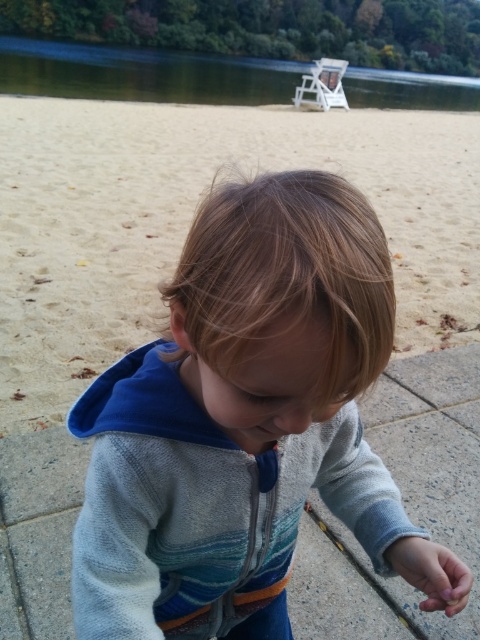
Question: Among these points, which one is farthest from the camera?

Choices:
 (A) (418, 186)
 (B) (260, 248)

Answer: (A)

Question: Which of the following is the closest to the observer?

Choices:
 (A) gray fleece hoodie at center
 (B) sandy at lower center
 (C) green smooth water at upper center
 (D) white plastic chair at upper center

Answer: (A)

Question: Can you confirm if green smooth water at upper center is bigger than white plastic chair at upper center?

Choices:
 (A) yes
 (B) no

Answer: (A)

Question: Does gray fleece hoodie at center appear over sandy at lower center?

Choices:
 (A) no
 (B) yes

Answer: (A)

Question: Which of the following is the farthest from the observer?

Choices:
 (A) green smooth water at upper center
 (B) sandy at lower center
 (C) white plastic chair at upper center
 (D) gray fleece hoodie at center

Answer: (C)

Question: Is sandy at lower center bigger than green smooth water at upper center?

Choices:
 (A) yes
 (B) no

Answer: (B)